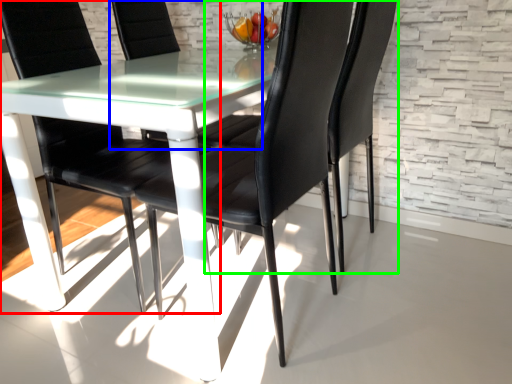
Question: Which object is positioned farthest from chair (highlighted by a red box)? Select from chair (highlighted by a blue box) and chair (highlighted by a green box).

Choices:
 (A) chair
 (B) chair

Answer: (B)